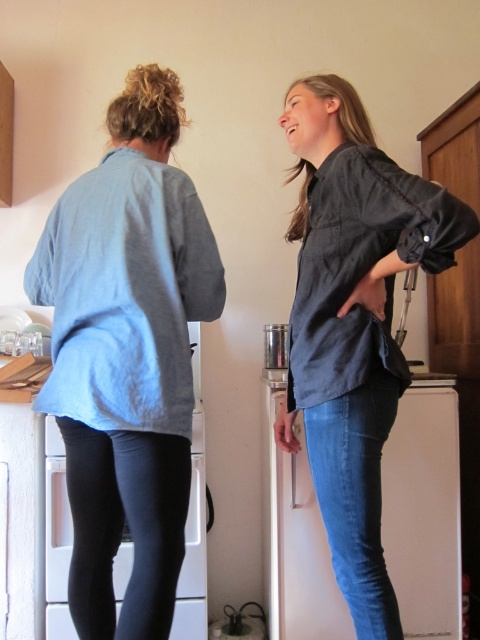
Consider the image. What is the exact location of the dark gray linen shirt at center in the image?

The dark gray linen shirt at center is located at point (354, 321).

You are standing in the kitchen and need to reach both the point at coordinates (327,624) and the point at coordinates (196,474). Which point will require you to move further away from your current position?

The point at coordinates (196,474) will require you to move further away from your current position because it is farther from the viewer compared to the point at coordinates (327,624).

You are in a kitchen and need to find the light blue cotton shirt at back. According to the coordinates provided, where should you look?

The light blue cotton shirt at back is located at coordinates point [127,355].